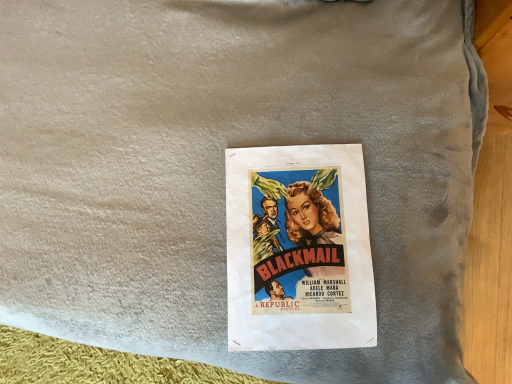
Identify the location of free space above vintage paper poster at center (from a real-world perspective). (300, 250).